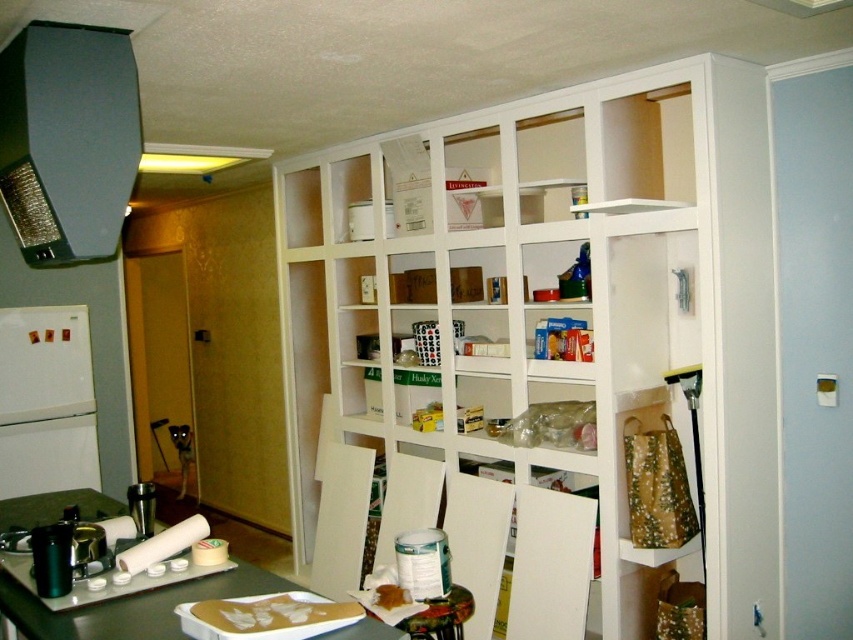
You are a delivery person who just brought a new microwave that is 5 feet wide. You need to place it between the white matte pantry at center and the satin black exhaust hood at upper left. Is there enough space?

The white matte pantry at center is 5.75 feet from the satin black exhaust hood at upper left. Since the microwave is 5 feet wide, there is enough space to place it between them as the distance between the two objects is greater than the microwave width.

Based on the photo, you are organizing the kitchen and need to place a new appliance. The white matte refrigerator at left is currently occupying space. Is there enough room to move it to the right side of the kitchen counter?

The white matte refrigerator at left is located at point [45,401]. Since the exact dimensions of the kitchen counter and the refrigerator are not provided, it is unclear if there is enough space to move it to the right side. Additional measurements would be needed to determine feasibility.

You are standing in the kitchen and need to reach both the point at coordinates point (541, 288) and the point at coordinates point (65, 97). Which point should you approach first to reach the one farther away last?

You should approach point (65, 97) first because point (541, 288) is behind it, so reaching the closer one first allows you to save time and reach the farther one last.